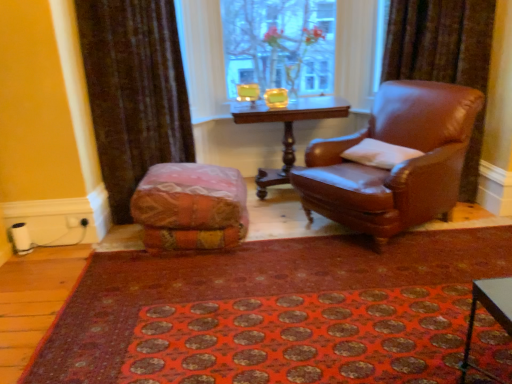
Question: Is textured multicolored bean bag at center spatially inside brown leather chair at right, or outside of it?

Choices:
 (A) inside
 (B) outside

Answer: (B)

Question: From the image's perspective, is textured multicolored bean bag at center above or below brown leather chair at right?

Choices:
 (A) below
 (B) above

Answer: (A)

Question: Which is farther from the transparent glass vase at upper center?

Choices:
 (A) textured multicolored bean bag at center
 (B) velvet brown curtain at left
 (C) red carpet at center
 (D) brown leather chair at right
 (E) white soft pillow at right

Answer: (C)

Question: Considering the real-world distances, which object is farthest from the white soft pillow at right?

Choices:
 (A) transparent glass vase at upper center
 (B) velvet brown curtain at left
 (C) wooden polished table at center
 (D) red carpet at center
 (E) textured multicolored bean bag at center

Answer: (B)